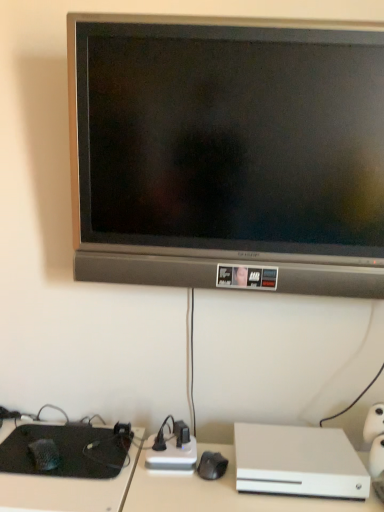
What are the coordinates of `empty space that is ontop of black matte keyboard at lower left (from a real-world perspective)` in the screenshot? It's located at (71, 444).